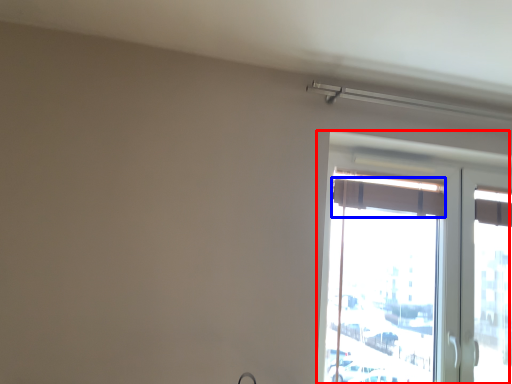
Question: Which object is closer to the camera taking this photo, window (highlighted by a red box) or curtain (highlighted by a blue box)?

Choices:
 (A) window
 (B) curtain

Answer: (A)